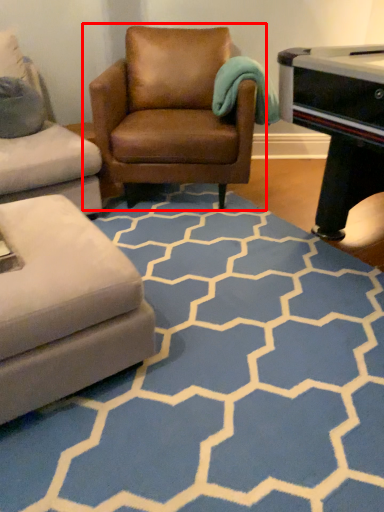
Question: From the image's perspective, what is the correct spatial positioning of chair (annotated by the red box) in reference to pattern?

Choices:
 (A) below
 (B) above

Answer: (B)